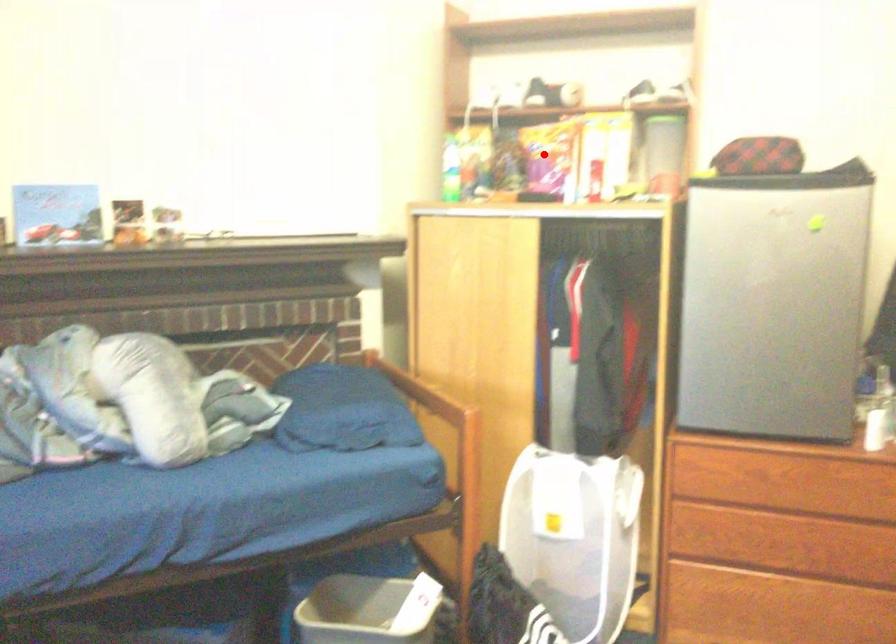
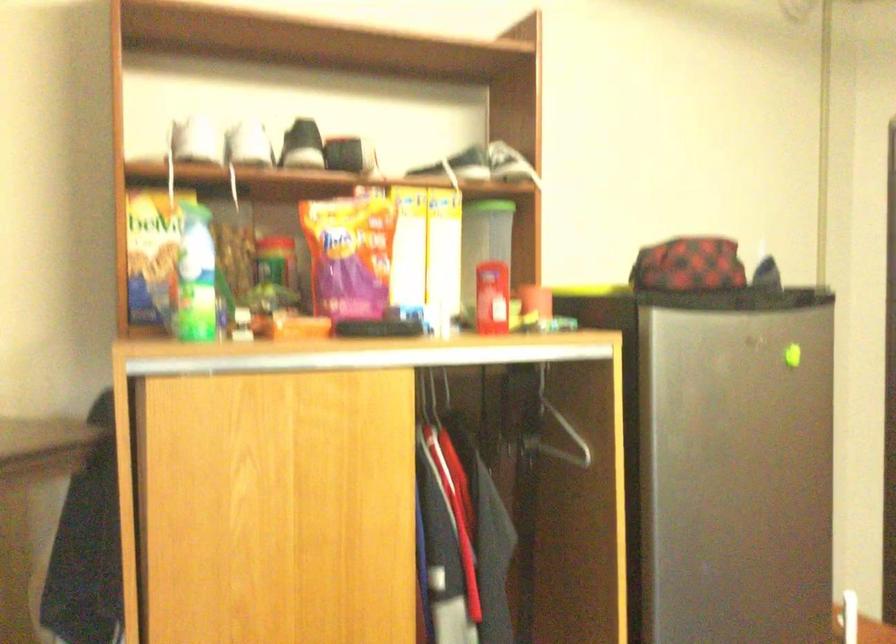
Question: I am providing you with two images of the same scene from different viewpoints. A red point is shown in image1. For the corresponding object point in image2, is it positioned nearer or farther from the camera?

Choices:
 (A) Nearer
 (B) Farther

Answer: (A)